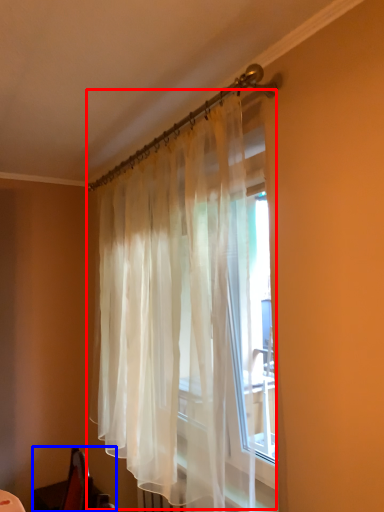
Question: Which of the following is the closest to the observer, curtain (highlighted by a red box) or swivel chair (highlighted by a blue box)?

Choices:
 (A) curtain
 (B) swivel chair

Answer: (A)